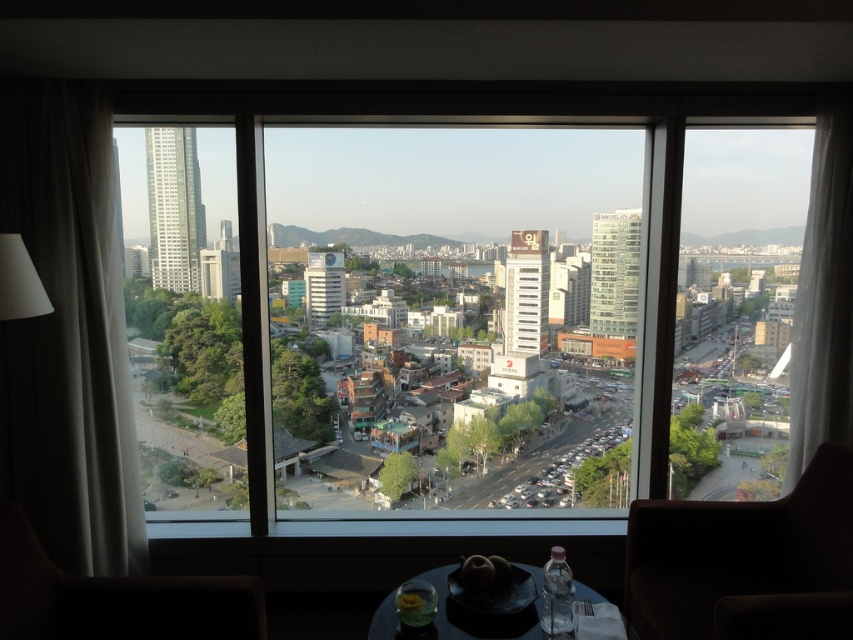
Between point (631, 228) and point (373, 625), which one is positioned behind?

Point (631, 228)

Is transparent glass building at right above matte black table at lower center?

Indeed, transparent glass building at right is positioned over matte black table at lower center.

Find the location of a particular element. This screenshot has width=853, height=640. transparent glass building at right is located at coordinates (614, 273).

Where is `transparent glass building at right`? transparent glass building at right is located at coordinates (614, 273).

In the scene shown: Between white glass skyscraper at left and transparent glass building at right, which one has less height?

Standing shorter between the two is transparent glass building at right.

Does white glass skyscraper at left have a greater width compared to transparent glass building at right?

Indeed, white glass skyscraper at left has a greater width compared to transparent glass building at right.

Between point (160, 138) and point (608, 232), which one is positioned in front?

Positioned in front is point (608, 232).

At what (x,y) coordinates should I click in order to perform the action: click on white glass skyscraper at left. Please return your answer as a coordinate pair (x, y). The image size is (853, 640). Looking at the image, I should click on (173, 208).

Is dark brown leather armchair at lower left positioned at the back of transparent glass building at right?

No, it is not.

Is dark brown leather armchair at lower left smaller than transparent glass building at right?

Correct, dark brown leather armchair at lower left occupies less space than transparent glass building at right.

At what (x,y) coordinates should I click in order to perform the action: click on dark brown leather armchair at lower left. Please return your answer as a coordinate pair (x, y). The image size is (853, 640). Looking at the image, I should click on (114, 598).